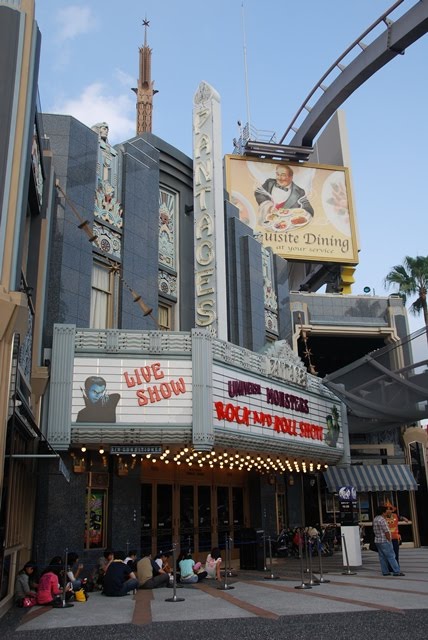
Locate an element on the screen. This screenshot has width=428, height=640. lights is located at coordinates (237, 454), (233, 457), (225, 461), (220, 464).